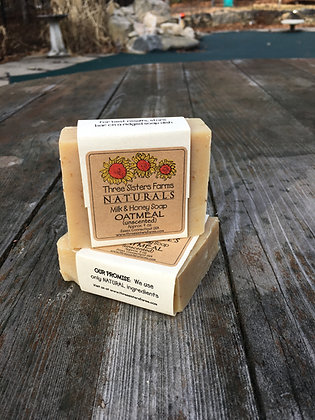
The width and height of the screenshot is (315, 420). I want to click on blue bin, so click(225, 0).